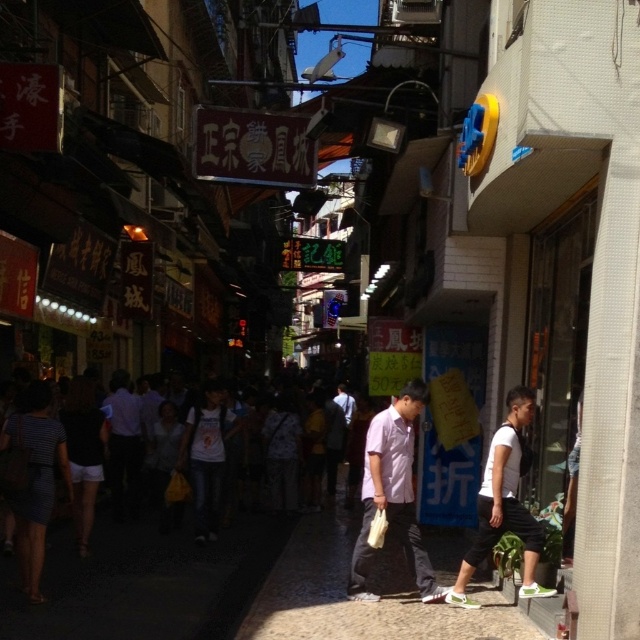
You are a delivery person carrying a large package and need to walk on the smooth concrete pavement at center and the dark gray clothing at center. Which surface is more suitable for carrying heavy items?

The smooth concrete pavement at center is more suitable for carrying heavy items because it is smaller and therefore provides a more stable surface compared to the dark gray clothing at center.

You are standing on the smooth concrete pavement at center and want to take a photo of the vibrant street signs. If your camera is 18.25 feet away from you, can you comfortably take the photo without moving your position?

The smooth concrete pavement at center and camera are 18.25 feet apart from each other, so yes, you can comfortably take the photo without moving your position since the distance is sufficient for a clear shot.